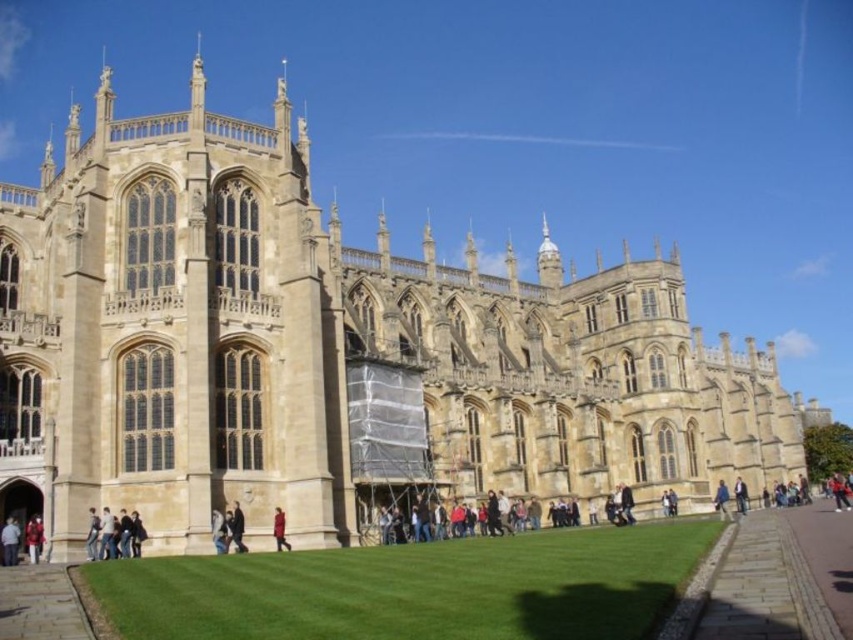
Question: Is dark blue jacket at center closer to the viewer compared to dark blue jacket at lower right?

Choices:
 (A) no
 (B) yes

Answer: (B)

Question: Where is red jacket at lower left located in relation to blue fabric jacket at lower right in the image?

Choices:
 (A) below
 (B) above

Answer: (B)

Question: Based on their relative distances, which object is farther from the red fabric coat at lower center?

Choices:
 (A) dark blue jacket at lower right
 (B) red jacket at lower left
 (C) light brown leather jacket at lower left

Answer: (A)

Question: Can you confirm if red jacket at lower left is positioned to the left of red fabric coat at lower center?

Choices:
 (A) yes
 (B) no

Answer: (A)

Question: Which object is the farthest from the green grass at lower center?

Choices:
 (A) red jacket at lower left
 (B) red fabric coat at lower center

Answer: (A)

Question: Which point is closer to the camera?

Choices:
 (A) green grass at lower center
 (B) dark blue jacket at lower right

Answer: (A)